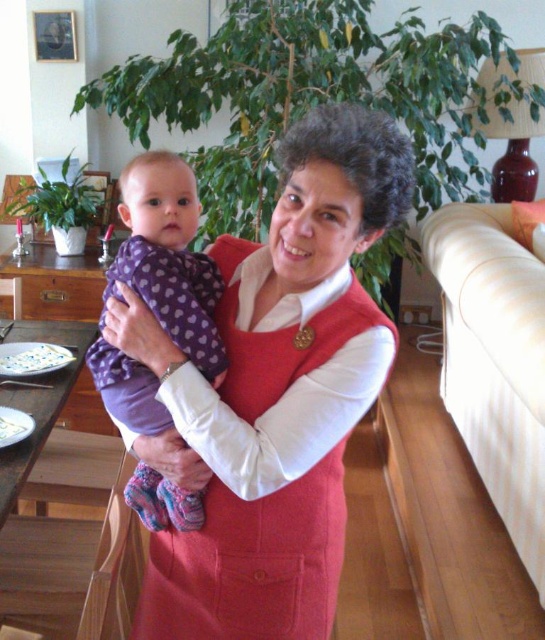
Is matte red dress at center below purple fleece onesie at center?

Yes, matte red dress at center is below purple fleece onesie at center.

Is matte red dress at center shorter than purple fleece onesie at center?

In fact, matte red dress at center may be taller than purple fleece onesie at center.

Does point (192, 484) come behind point (169, 166)?

No, (192, 484) is in front of (169, 166).

The image size is (545, 640). What are the coordinates of `matte red dress at center` in the screenshot? It's located at (275, 394).